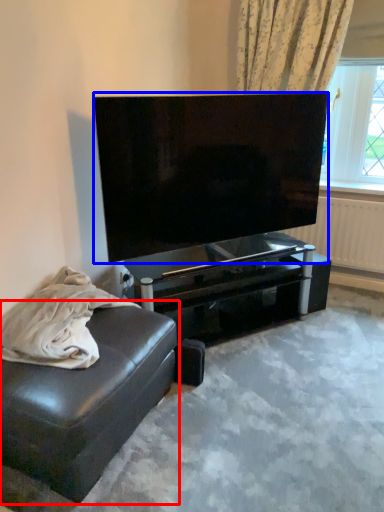
Question: Which of the following is the farthest to the observer, studio couch (highlighted by a red box) or television (highlighted by a blue box)?

Choices:
 (A) studio couch
 (B) television

Answer: (B)